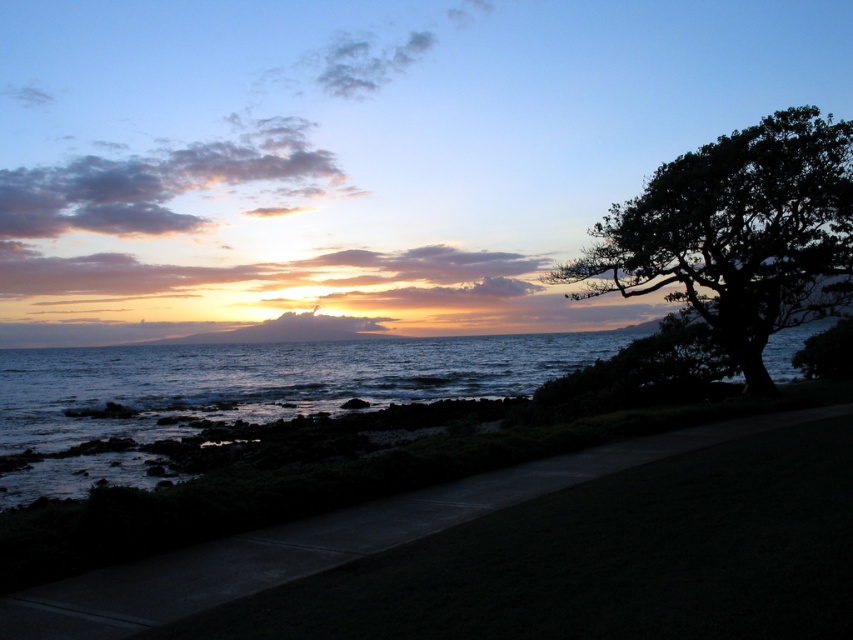
You are standing on the shore looking at the dark blue water at center and the dark green leafy tree at right. Which object is closer to you?

The dark blue water at center is closer to you than the dark green leafy tree at right because it is further to the viewer.

From the picture: You are standing on the rocky shoreline and want to take a photo that includes both the dark blue water at center and the dark green leafy tree at right. Which object should you position closer to the foreground to ensure both are in frame?

You should position the dark green leafy tree at right closer to the foreground because it is taller than the dark blue water at center, so placing it closer will help keep both in frame without one being cut off.

You are standing on the rocky shoreline and want to take a photo of the dark blue water at center and the dark green leafy tree at right. Which object should you frame first in your camera to ensure both are in the shot?

You should frame the dark green leafy tree at right first because the dark blue water at center is positioned on the left side of it, so by starting with the tree on the right, you can adjust the camera to include both objects in the frame.